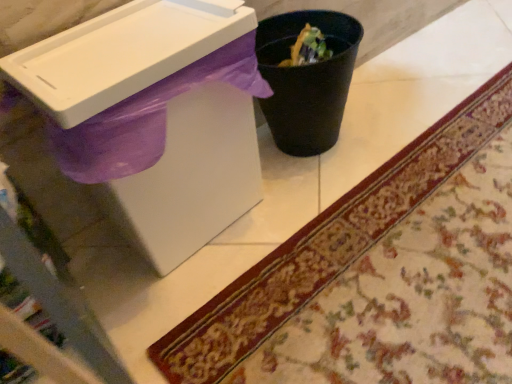
Question: Is black plastic trash can at center at the right side of white plastic sink at upper left?

Choices:
 (A) no
 (B) yes

Answer: (B)

Question: Considering the relative positions of black plastic trash can at center and white plastic sink at upper left in the image provided, is black plastic trash can at center behind white plastic sink at upper left?

Choices:
 (A) no
 (B) yes

Answer: (B)

Question: Is black plastic trash can at center thinner than white plastic sink at upper left?

Choices:
 (A) yes
 (B) no

Answer: (A)

Question: Is black plastic trash can at center wider than white plastic sink at upper left?

Choices:
 (A) yes
 (B) no

Answer: (B)

Question: Is black plastic trash can at center positioned in front of white plastic sink at upper left?

Choices:
 (A) no
 (B) yes

Answer: (A)

Question: From a real-world perspective, is black plastic trash can at center on top of white plastic sink at upper left?

Choices:
 (A) no
 (B) yes

Answer: (A)

Question: Is black plastic trash can at center to the right of carpeted mat at lower right from the viewer's perspective?

Choices:
 (A) yes
 (B) no

Answer: (B)

Question: Can you confirm if black plastic trash can at center is thinner than carpeted mat at lower right?

Choices:
 (A) no
 (B) yes

Answer: (B)

Question: From a real-world perspective, is black plastic trash can at center on carpeted mat at lower right?

Choices:
 (A) yes
 (B) no

Answer: (A)

Question: Considering the relative sizes of black plastic trash can at center and carpeted mat at lower right in the image provided, is black plastic trash can at center bigger than carpeted mat at lower right?

Choices:
 (A) no
 (B) yes

Answer: (B)

Question: Is black plastic trash can at center oriented away from carpeted mat at lower right?

Choices:
 (A) yes
 (B) no

Answer: (B)

Question: Is black plastic trash can at center facing towards carpeted mat at lower right?

Choices:
 (A) yes
 (B) no

Answer: (A)

Question: Can you confirm if carpeted mat at lower right is shorter than black plastic trash can at center?

Choices:
 (A) yes
 (B) no

Answer: (A)